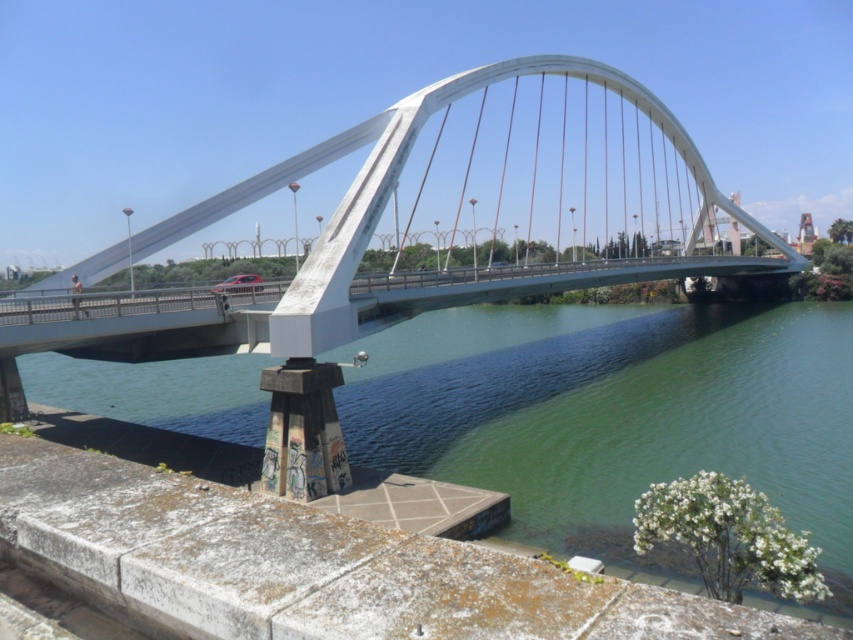
Consider the image. You are a delivery drone that needs to fly over the green concrete river at lower center and the white metallic arch bridge at center. Which one requires you to ascend higher to avoid collision?

The white metallic arch bridge at center requires you to ascend higher to avoid collision because it has a greater height than the green concrete river at lower center.

You are a pedestrian standing on the white metallic arch bridge at center. You want to get to the green concrete river at lower center. Which direction should you walk towards?

The green concrete river at lower center is to the left of the white metallic arch bridge at center, so you should walk towards the left to reach it.